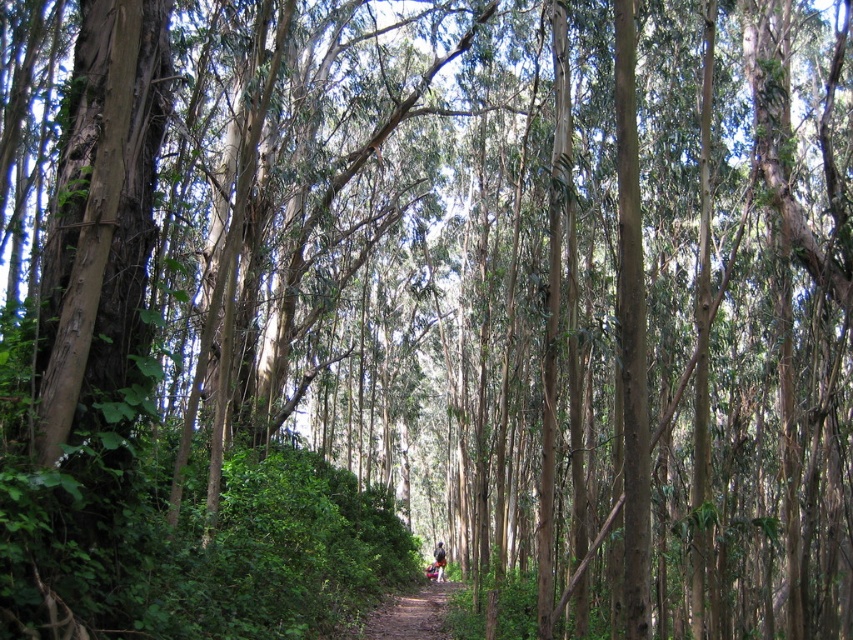
Question: Does brown dirt path at center have a lesser width compared to camouflage fabric person at center?

Choices:
 (A) yes
 (B) no

Answer: (B)

Question: Which point is closer to the camera?

Choices:
 (A) (440, 564)
 (B) (375, 636)

Answer: (B)

Question: Can you confirm if brown dirt path at center is positioned to the left of camouflage fabric person at center?

Choices:
 (A) yes
 (B) no

Answer: (A)

Question: Is brown dirt path at center thinner than camouflage fabric person at center?

Choices:
 (A) yes
 (B) no

Answer: (B)